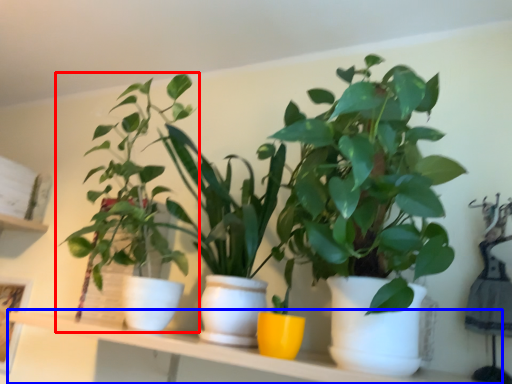
Question: Among these objects, which one is farthest to the camera, houseplant (highlighted by a red box) or window sill (highlighted by a blue box)?

Choices:
 (A) houseplant
 (B) window sill

Answer: (A)